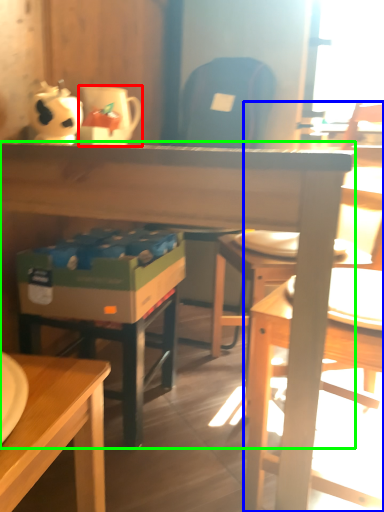
Question: Which object is the farthest from coffee cup (highlighted by a red box)? Choose among these: chair (highlighted by a blue box) or desk (highlighted by a green box).

Choices:
 (A) chair
 (B) desk

Answer: (A)